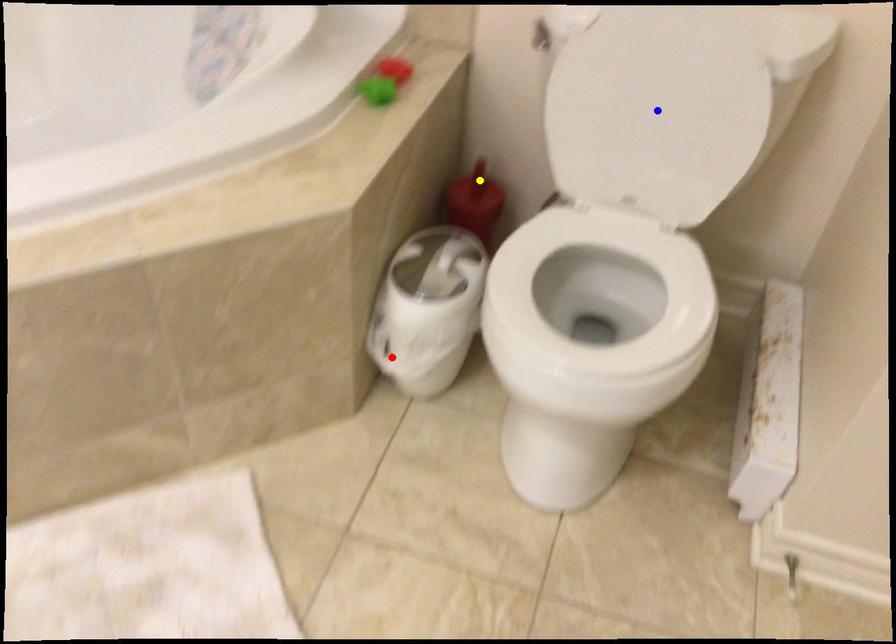
Order these from nearest to farthest:
1. red point
2. blue point
3. yellow point

blue point, red point, yellow point